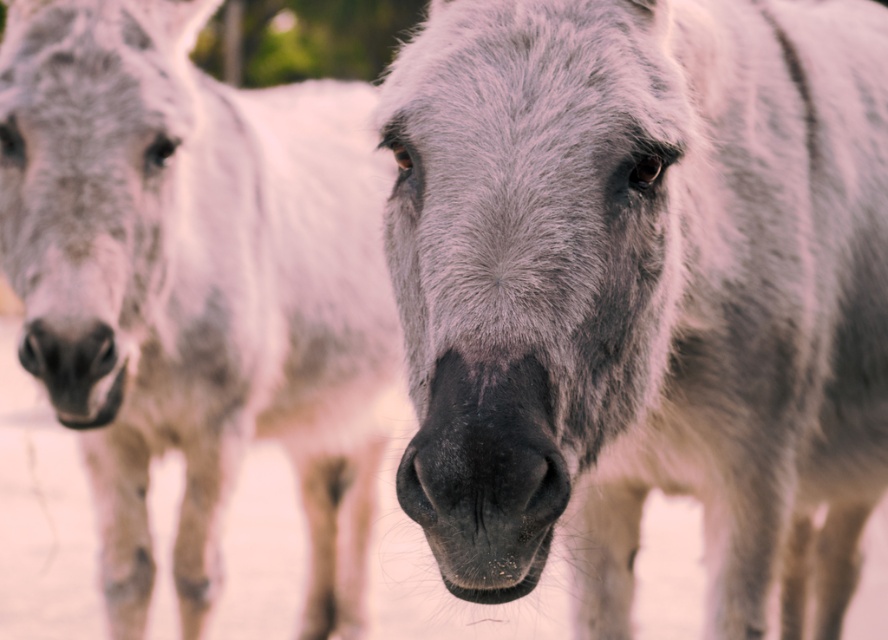
Question: Considering the relative positions of fuzzy white donkey at center and gray matte donkey at center in the image provided, where is fuzzy white donkey at center located with respect to gray matte donkey at center?

Choices:
 (A) above
 (B) below

Answer: (B)

Question: Which of the following is the closest to the observer?

Choices:
 (A) fuzzy white donkey at center
 (B) gray matte donkey at center

Answer: (A)

Question: Which point is closer to the camera taking this photo?

Choices:
 (A) (312, 595)
 (B) (548, 355)

Answer: (B)

Question: Is the position of fuzzy white donkey at center less distant than that of gray matte donkey at center?

Choices:
 (A) no
 (B) yes

Answer: (B)

Question: Which of the following is the farthest from the observer?

Choices:
 (A) fuzzy white donkey at center
 (B) gray matte donkey at center

Answer: (B)

Question: Is fuzzy white donkey at center further to the viewer compared to gray matte donkey at center?

Choices:
 (A) yes
 (B) no

Answer: (B)